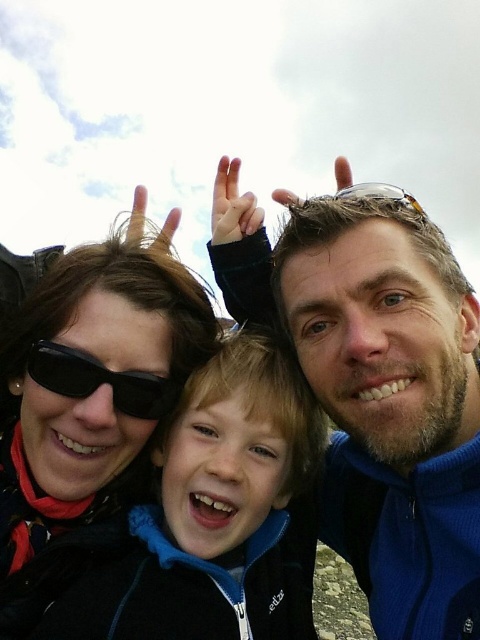
Which of these two, blue fleece jacket at center or black matte sunglasses at upper left, stands taller?

blue fleece jacket at center is taller.

Can you confirm if blue fleece jacket at center is taller than black matte sunglasses at upper left?

Indeed, blue fleece jacket at center has a greater height compared to black matte sunglasses at upper left.

Which is behind, point (406, 349) or point (38, 598)?

Point (406, 349)

Locate an element on the screen. blue fleece jacket at center is located at coordinates (377, 388).

Which is above, black fleece jacket at center or black matte sunglasses at upper left?

Positioned higher is black matte sunglasses at upper left.

Who is positioned more to the right, black fleece jacket at center or black matte sunglasses at upper left?

black fleece jacket at center is more to the right.

Is point (187, 428) positioned behind point (15, 524)?

Yes, point (187, 428) is farther from viewer.

The width and height of the screenshot is (480, 640). Find the location of `black fleece jacket at center`. black fleece jacket at center is located at coordinates (217, 515).

Is black matte sunglasses at upper left to the left of black matte sunglasses at lower left from the viewer's perspective?

Correct, you'll find black matte sunglasses at upper left to the left of black matte sunglasses at lower left.

Locate an element on the screen. The width and height of the screenshot is (480, 640). black matte sunglasses at upper left is located at coordinates (87, 403).